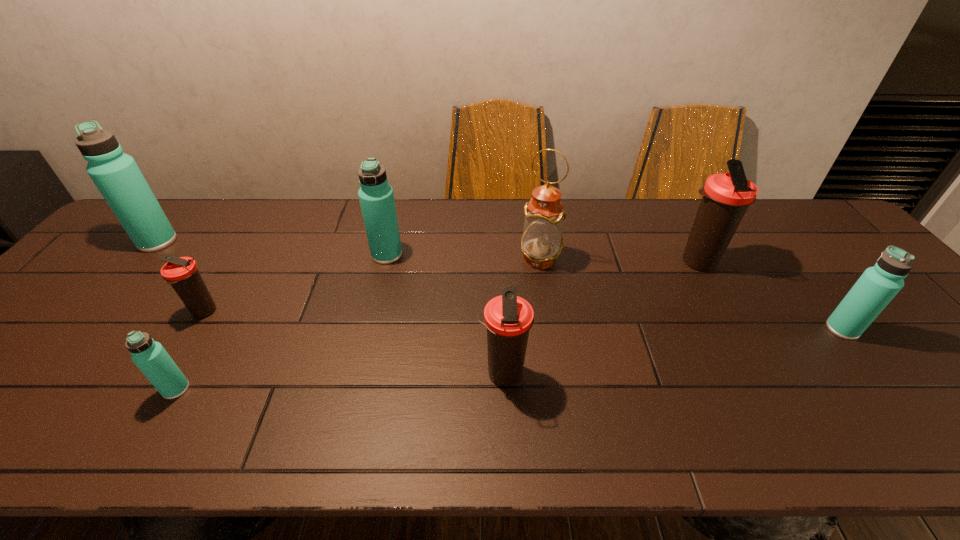
Image resolution: width=960 pixels, height=540 pixels. What are the coordinates of `free space located 0.250m on the back of the rightmost object` in the screenshot? It's located at (783, 254).

Identify the location of blank space located 0.120m on the back of the second farthest brown thermos bottle. This screenshot has height=540, width=960. (230, 269).

Locate an element on the screen. The height and width of the screenshot is (540, 960). free spot located on the back of the nearest aqua thermos bottle is located at coordinates pos(229,297).

You are a GUI agent. You are given a task and a screenshot of the screen. Output one action in this format:
    pyautogui.click(x=<x>, y=<y>)
    Task: Click on the object that is positioned at the left edge
    
    Given the screenshot: What is the action you would take?
    pyautogui.click(x=116, y=175)

Locate an element on the screen. This screenshot has height=540, width=960. object located in the far left corner section of the desktop is located at coordinates (116, 175).

In the image, there is a desktop. Identify the location of vacant space at the far edge. (298, 216).

The height and width of the screenshot is (540, 960). Identify the location of free point at the near edge. (633, 440).

In the image, there is a desktop. Identify the location of vacant space at the left edge. This screenshot has height=540, width=960. (97, 321).

Identify the location of free space between the second brown thermos bottle from left to right and the rightmost brown thermos bottle. This screenshot has width=960, height=540. (600, 318).

Where is `free spot between the second nearest aqua thermos bottle and the leftmost object`? The image size is (960, 540). free spot between the second nearest aqua thermos bottle and the leftmost object is located at coordinates (500, 285).